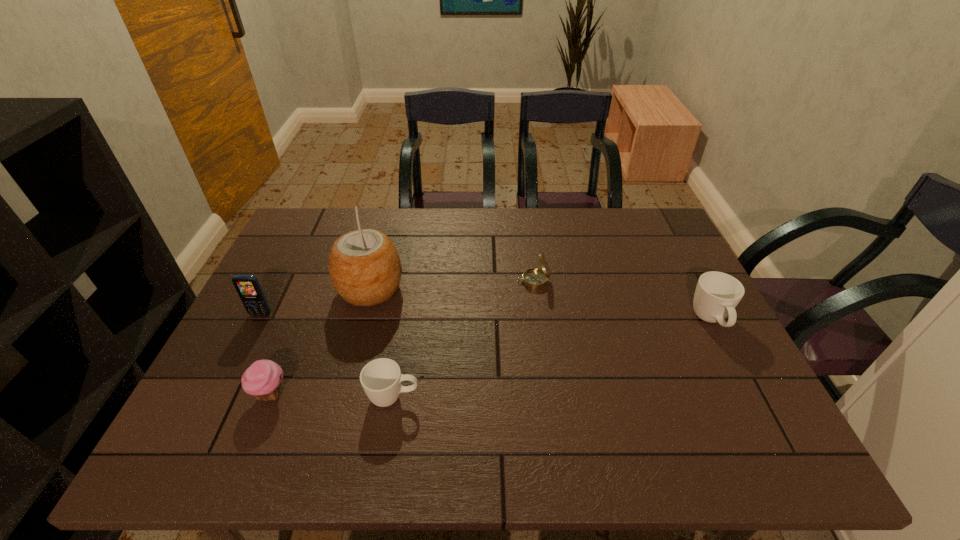
This screenshot has width=960, height=540. In order to click on vacant area situated with the handle on the side of the right cup in this screenshot , I will do point(747,390).

Locate an element on the screen. The image size is (960, 540). vacant space located 0.250m on the screen of the cellular telephone is located at coordinates (218, 399).

Where is `free space located 0.270m with the dial facing the compass`? This screenshot has height=540, width=960. free space located 0.270m with the dial facing the compass is located at coordinates (424, 281).

I want to click on free space located with the dial facing the compass, so click(445, 281).

Identify the location of free region located with the dial facing the compass. (479, 281).

Identify the location of free space located 0.250m on the back of the tallest object. (389, 220).

Identify the location of free region located on the back of the cupcake. This screenshot has height=540, width=960. (293, 339).

I want to click on cup at the near edge, so click(381, 378).

The height and width of the screenshot is (540, 960). Find the location of `cupcake present at the near edge`. cupcake present at the near edge is located at coordinates (262, 379).

Where is `cellular telephone at the left edge`? cellular telephone at the left edge is located at coordinates (248, 288).